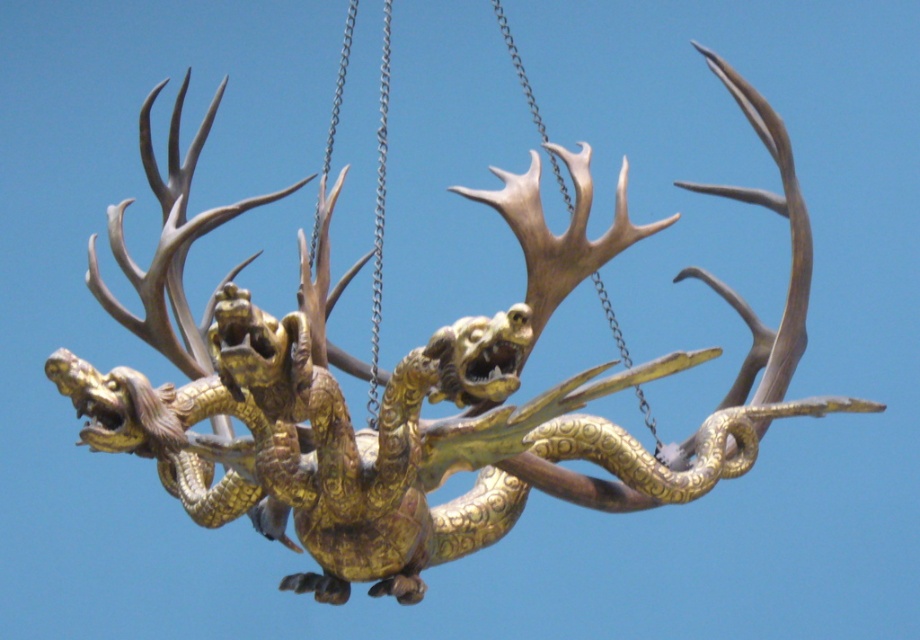
Is silver metallic chain at center to the right of metallic chain at center from the viewer's perspective?

No, silver metallic chain at center is not to the right of metallic chain at center.

Who is higher up, silver metallic chain at center or metallic chain at center?

metallic chain at center is higher up.

Identify the location of silver metallic chain at center. (378, 218).